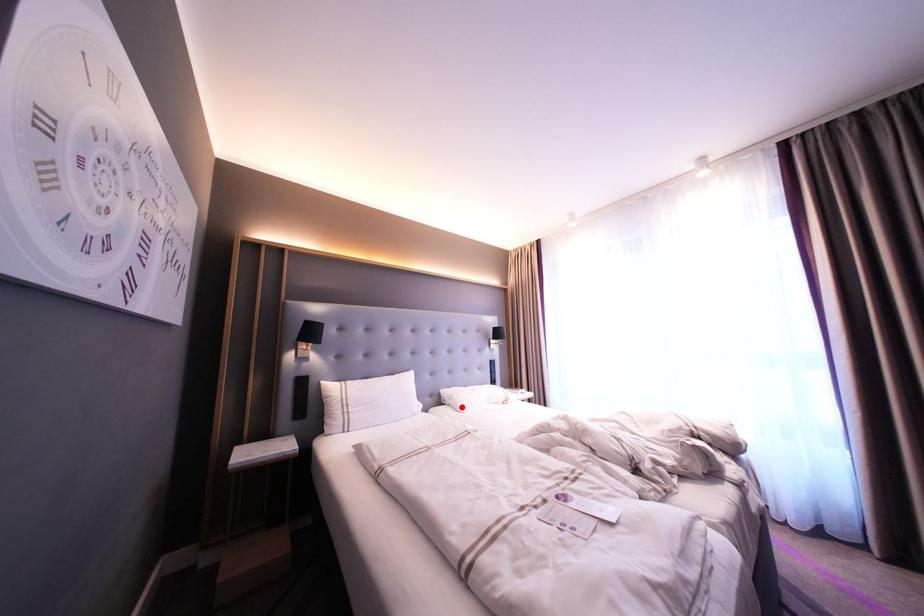
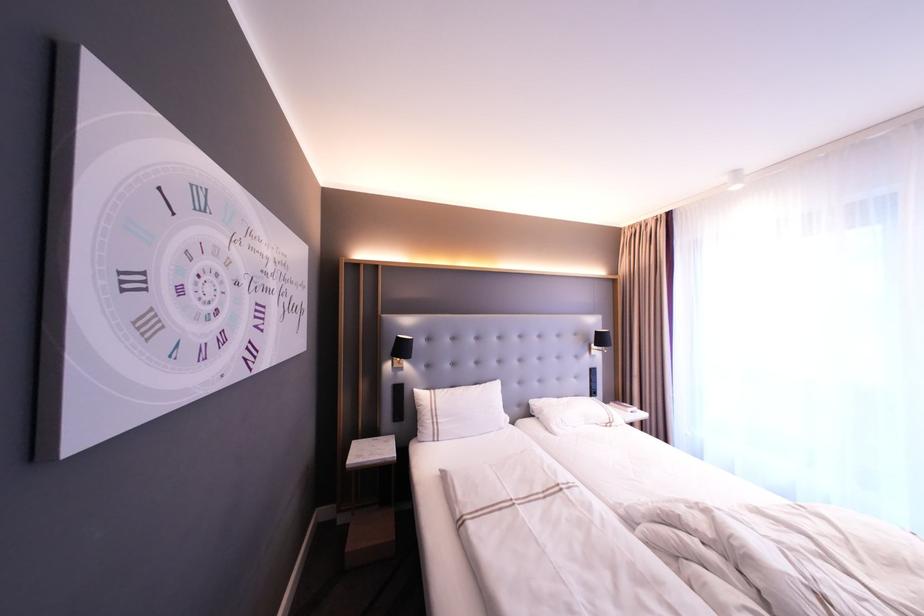
Find the pixel in the second image that matches the highlighted location in the first image.

(553, 427)